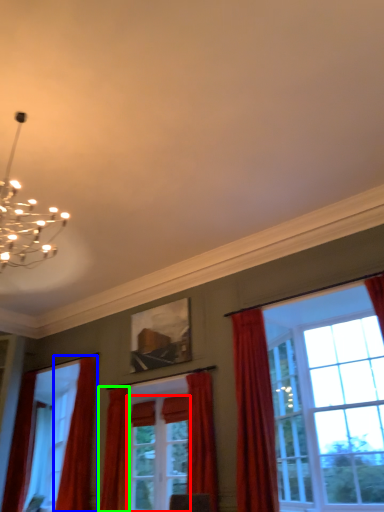
Question: Which is farther away from screen door (highlighted by a red box)? curtain (highlighted by a blue box) or curtain (highlighted by a green box)?

Choices:
 (A) curtain
 (B) curtain

Answer: (A)